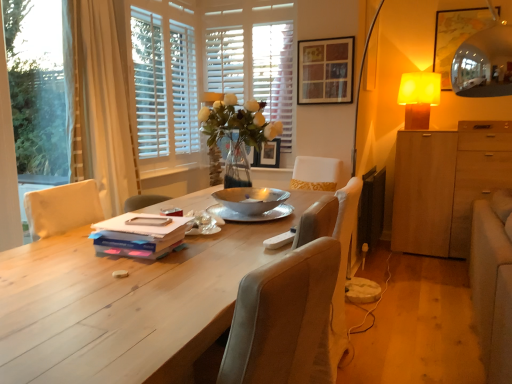
Question: From the image's perspective, is white wood window frame at upper center positioned above or below wooden picture frame at upper center, which is counted as the first picture frame, starting from the right?

Choices:
 (A) below
 (B) above

Answer: (A)

Question: From a real-world perspective, is white wood window frame at upper center physically located above or below wooden picture frame at upper center, the 2th picture frame positioned from the back?

Choices:
 (A) below
 (B) above

Answer: (A)

Question: Considering the real-world distances, which object is farthest from the matte blue book at center?

Choices:
 (A) wooden picture frame at upper center, the 2th picture frame viewed from the right
 (B) beige fabric curtain at left
 (C) light wood table at center
 (D) yellow fabric lampshade at upper right
 (E) transparent plastic window screen at left

Answer: (D)

Question: Based on their relative distances, which object is nearer to the velvet beige chair at center?

Choices:
 (A) white wood blinds at upper center
 (B) light brown wood cabinet at right
 (C) beige fabric curtain at left
 (D) wooden picture frame at upper center, the 2th picture frame positioned from the back
 (E) wooden picture frame at upper center, acting as the first picture frame starting from the bottom

Answer: (C)